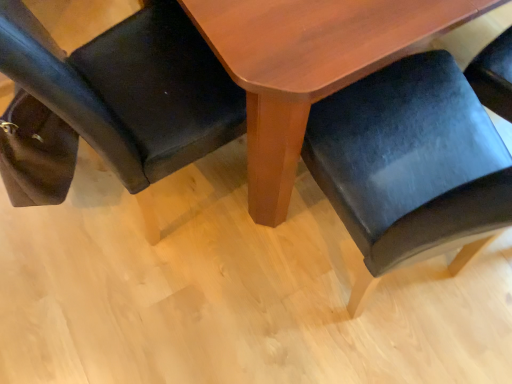
Locate an element on the screen. The image size is (512, 384). matte black chair at lower left, the first chair positioned from the left is located at coordinates (111, 101).

This screenshot has width=512, height=384. What do you see at coordinates (309, 66) in the screenshot?
I see `wooden table at center` at bounding box center [309, 66].

In the scene shown: In order to face wooden table at center, should I rotate leftwards or rightwards?

Turn right approximately 16.594 degrees to face it.

You are a GUI agent. You are given a task and a screenshot of the screen. Output one action in this format:
    pyautogui.click(x=<x>, y=<y>)
    Task: Click on the matte black chair at lower left, the first chair positioned from the left
    The width and height of the screenshot is (512, 384).
    Given the screenshot: What is the action you would take?
    click(111, 101)

Is wooden table at center surrounding matte black chair at lower left, marked as the 2th chair in a right-to-left arrangement?

Yes, matte black chair at lower left, marked as the 2th chair in a right-to-left arrangement, is a part of wooden table at center.

Which is more to the left, wooden table at center or matte black chair at lower left, marked as the 2th chair in a right-to-left arrangement?

Positioned to the left is matte black chair at lower left, marked as the 2th chair in a right-to-left arrangement.

Looking at their sizes, would you say wooden table at center is wider or thinner than matte black chair at lower left, marked as the 2th chair in a right-to-left arrangement?

In the image, wooden table at center appears to be wider than matte black chair at lower left, marked as the 2th chair in a right-to-left arrangement.

Can you tell me how much wooden table at center and matte black chair at lower left, the first chair positioned from the left, differ in facing direction?

The angle between the facing direction of wooden table at center and the facing direction of matte black chair at lower left, the first chair positioned from the left, is 100 degrees.

Considering the sizes of objects velvet black chair at lower right, acting as the 2th chair starting from the left, and wooden table at center in the image provided, who is bigger, velvet black chair at lower right, acting as the 2th chair starting from the left, or wooden table at center?

Bigger between the two is wooden table at center.

Can we say velvet black chair at lower right, which is counted as the first chair, starting from the right, lies outside wooden table at center?

velvet black chair at lower right, which is counted as the first chair, starting from the right, is positioned outside wooden table at center.

From a real-world perspective, starting from the wooden table at center, which chair is the 2nd one vertically above it? Please provide its 2D coordinates.

[(410, 165)]

From the picture: Can you confirm if matte black chair at lower left, the first chair positioned from the left, is wider than velvet black chair at lower right, acting as the 2th chair starting from the left?

Correct, the width of matte black chair at lower left, the first chair positioned from the left, exceeds that of velvet black chair at lower right, acting as the 2th chair starting from the left.

Which object is positioned more to the left, matte black chair at lower left, the first chair positioned from the left, or velvet black chair at lower right, which is counted as the first chair, starting from the right?

From the viewer's perspective, matte black chair at lower left, the first chair positioned from the left, appears more on the left side.

Consider the image. Is there a large distance between matte black chair at lower left, the first chair positioned from the left, and velvet black chair at lower right, acting as the 2th chair starting from the left?

Actually, matte black chair at lower left, the first chair positioned from the left, and velvet black chair at lower right, acting as the 2th chair starting from the left, are a little close together.

Which object is further away from the camera taking this photo, matte black chair at lower left, the first chair positioned from the left, or velvet black chair at lower right, acting as the 2th chair starting from the left?

matte black chair at lower left, the first chair positioned from the left, is further from the camera.

From the image's perspective, is velvet black chair at lower right, acting as the 2th chair starting from the left, on top of matte black chair at lower left, marked as the 2th chair in a right-to-left arrangement?

Actually, velvet black chair at lower right, acting as the 2th chair starting from the left, appears below matte black chair at lower left, marked as the 2th chair in a right-to-left arrangement, in the image.

Between velvet black chair at lower right, acting as the 2th chair starting from the left, and matte black chair at lower left, the first chair positioned from the left, which one has larger width?

With larger width is matte black chair at lower left, the first chair positioned from the left.

In the scene shown: Is velvet black chair at lower right, which is counted as the first chair, starting from the right, far from matte black chair at lower left, marked as the 2th chair in a right-to-left arrangement?

They are positioned close to each other.

Who is taller, velvet black chair at lower right, acting as the 2th chair starting from the left, or matte black chair at lower left, the first chair positioned from the left?

velvet black chair at lower right, acting as the 2th chair starting from the left, is taller.

At what (x,y) coordinates should I click in order to perform the action: click on the 2nd chair below the wooden table at center (from the image's perspective). Please return your answer as a coordinate pair (x, y). This screenshot has width=512, height=384. Looking at the image, I should click on (410, 165).

Visually, is wooden table at center positioned to the left or to the right of velvet black chair at lower right, which is counted as the first chair, starting from the right?

From the image, it's evident that wooden table at center is to the right of velvet black chair at lower right, which is counted as the first chair, starting from the right.

Based on the photo, who is more distant, wooden table at center or velvet black chair at lower right, which is counted as the first chair, starting from the right?

wooden table at center is further from the camera.

Between wooden table at center and velvet black chair at lower right, acting as the 2th chair starting from the left, which one has smaller width?

velvet black chair at lower right, acting as the 2th chair starting from the left.

Does point (198, 150) come closer to viewer compared to point (444, 18)?

No, (198, 150) is behind (444, 18).

Is matte black chair at lower left, marked as the 2th chair in a right-to-left arrangement, touching wooden table at center?

No.

Would you say matte black chair at lower left, marked as the 2th chair in a right-to-left arrangement, is inside or outside wooden table at center?

matte black chair at lower left, marked as the 2th chair in a right-to-left arrangement, fits inside wooden table at center.

How much distance is there between matte black chair at lower left, marked as the 2th chair in a right-to-left arrangement, and wooden table at center?

matte black chair at lower left, marked as the 2th chair in a right-to-left arrangement, and wooden table at center are 13.05 inches apart.

The height and width of the screenshot is (384, 512). I want to click on table that appears above the matte black chair at lower left, the first chair positioned from the left (from the image's perspective), so click(309, 66).

Where is `table below the velvet black chair at lower right, which is counted as the first chair, starting from the right (from a real-world perspective)`? The image size is (512, 384). table below the velvet black chair at lower right, which is counted as the first chair, starting from the right (from a real-world perspective) is located at coordinates (309, 66).

Looking at the image, which one is located closer to matte black chair at lower left, the first chair positioned from the left, wooden table at center or velvet black chair at lower right, acting as the 2th chair starting from the left?

wooden table at center is positioned closer to the anchor matte black chair at lower left, the first chair positioned from the left.

Considering their positions, is matte black chair at lower left, the first chair positioned from the left, positioned closer to wooden table at center than velvet black chair at lower right, which is counted as the first chair, starting from the right?

The object closer to wooden table at center is velvet black chair at lower right, which is counted as the first chair, starting from the right.

Considering their positions, is wooden table at center positioned further to velvet black chair at lower right, acting as the 2th chair starting from the left, than matte black chair at lower left, marked as the 2th chair in a right-to-left arrangement?

matte black chair at lower left, marked as the 2th chair in a right-to-left arrangement, lies further to velvet black chair at lower right, acting as the 2th chair starting from the left, than the other object.

Estimate the real-world distances between objects in this image. Which object is further from velvet black chair at lower right, acting as the 2th chair starting from the left, matte black chair at lower left, the first chair positioned from the left, or wooden table at center?

matte black chair at lower left, the first chair positioned from the left.

Considering their positions, is velvet black chair at lower right, which is counted as the first chair, starting from the right, positioned further to matte black chair at lower left, marked as the 2th chair in a right-to-left arrangement, than wooden table at center?

Based on the image, velvet black chair at lower right, which is counted as the first chair, starting from the right, appears to be further to matte black chair at lower left, marked as the 2th chair in a right-to-left arrangement.

From the image, which object appears to be farther from wooden table at center, velvet black chair at lower right, acting as the 2th chair starting from the left, or matte black chair at lower left, marked as the 2th chair in a right-to-left arrangement?

Based on the image, matte black chair at lower left, marked as the 2th chair in a right-to-left arrangement, appears to be further to wooden table at center.

This screenshot has height=384, width=512. Identify the location of chair situated between matte black chair at lower left, the first chair positioned from the left, and wooden table at center from left to right. pos(410,165).